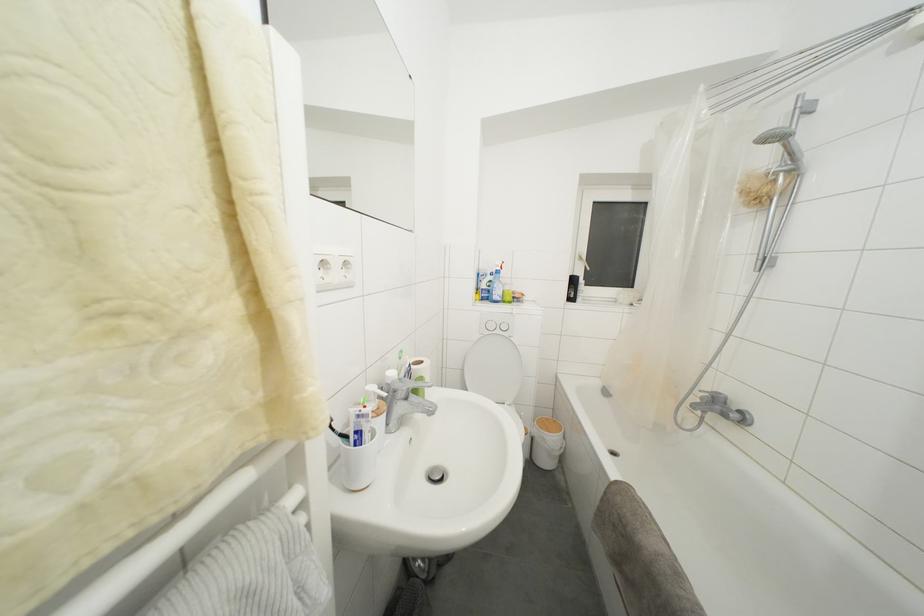
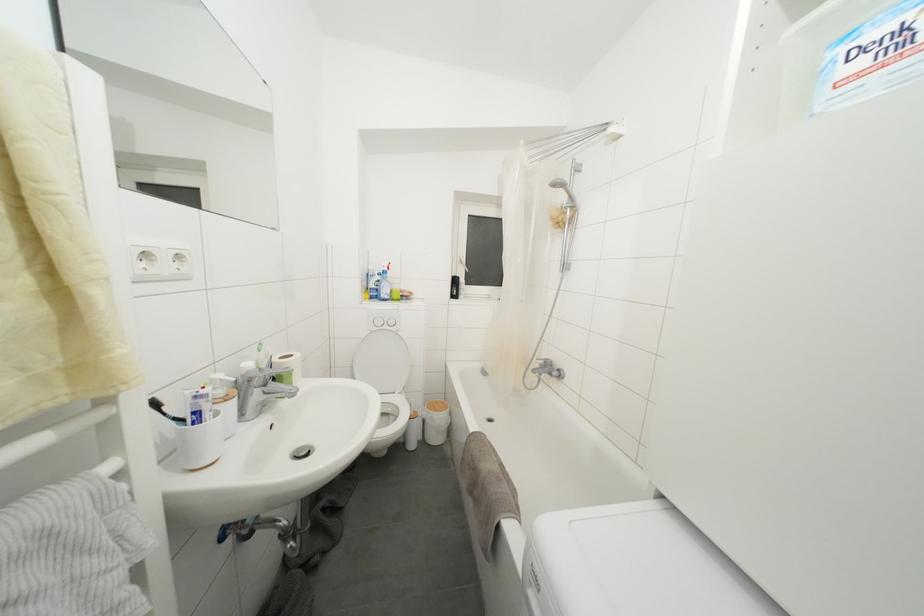
Find the pixel in the second image that matches [703,392] in the first image.

(540, 362)